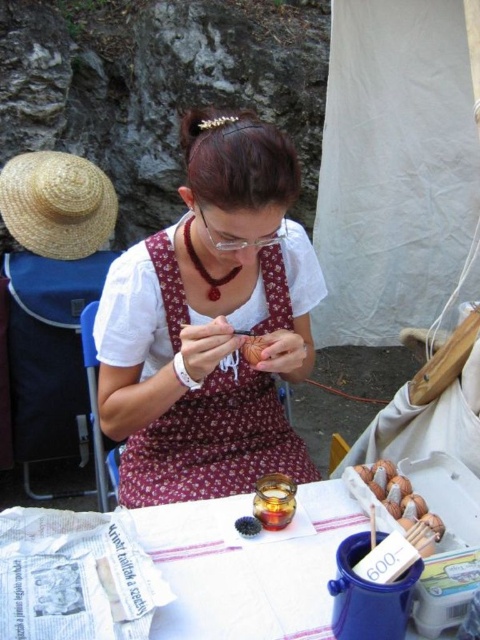
Question: Can you confirm if white paper at lower center is thinner than straw hat at left?

Choices:
 (A) no
 (B) yes

Answer: (A)

Question: Which object is positioned farthest from the brown textured bread at center?

Choices:
 (A) straw hat at left
 (B) matte brown apron at center
 (C) white paper at lower center
 (D) brown wooden beads at lower right

Answer: (A)

Question: Which point appears farthest from the camera in this image?

Choices:
 (A) (240, 618)
 (B) (377, 472)

Answer: (B)

Question: Where is straw hat at left located in relation to brown textured bread at center in the image?

Choices:
 (A) above
 (B) below

Answer: (A)

Question: Which object is closer to the camera taking this photo?

Choices:
 (A) straw hat at left
 (B) white paper at lower center
 (C) brown textured bread at center

Answer: (B)

Question: Does matte brown apron at center have a larger size compared to straw hat at left?

Choices:
 (A) no
 (B) yes

Answer: (B)